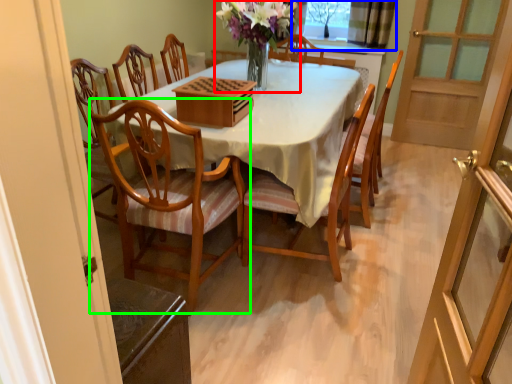
Question: Considering the real-world distances, which object is closest to floral arrangement (highlighted by a red box)? window (highlighted by a blue box) or chair (highlighted by a green box).

Choices:
 (A) window
 (B) chair

Answer: (B)